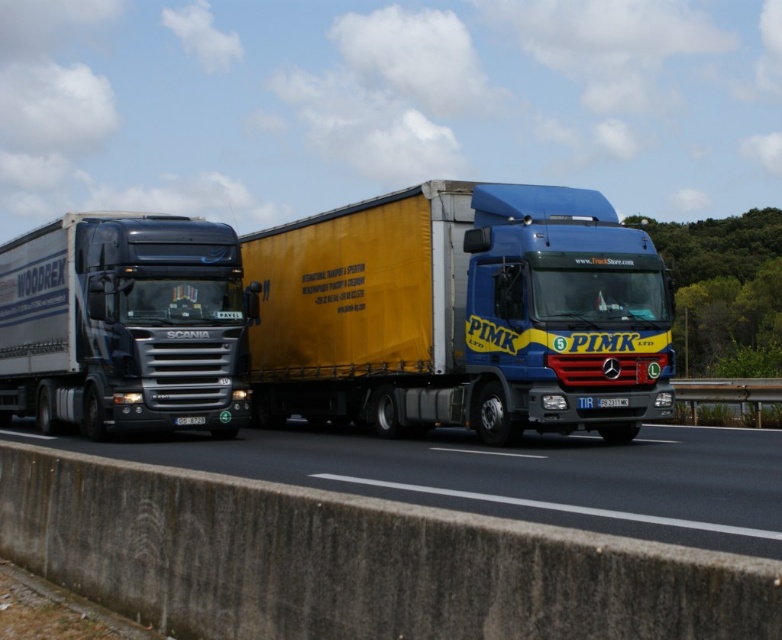
Between metallic silver truck at left and concrete barrier at lower left, which one is positioned lower?

Positioned lower is concrete barrier at lower left.

In the scene shown: Between metallic silver truck at left and concrete barrier at lower left, which one is positioned higher?

metallic silver truck at left

Is point (164, 316) less distant than point (725, 500)?

No, it is behind (725, 500).

Identify the location of metallic silver truck at left. Image resolution: width=782 pixels, height=640 pixels. (124, 324).

Does yellow matte trailer truck at center have a smaller size compared to concrete barrier at lower left?

Actually, yellow matte trailer truck at center might be larger than concrete barrier at lower left.

In the scene shown: Can you confirm if yellow matte trailer truck at center is bigger than concrete barrier at lower left?

Correct, yellow matte trailer truck at center is larger in size than concrete barrier at lower left.

Image resolution: width=782 pixels, height=640 pixels. Describe the element at coordinates (461, 314) in the screenshot. I see `yellow matte trailer truck at center` at that location.

At what (x,y) coordinates should I click in order to perform the action: click on yellow matte trailer truck at center. Please return your answer as a coordinate pair (x, y). Looking at the image, I should click on (461, 314).

Does yellow matte trailer truck at center have a greater height compared to metallic silver truck at left?

No.

Is point (637, 228) positioned behind point (117, 273)?

No.

At what (x,y) coordinates should I click in order to perform the action: click on yellow matte trailer truck at center. Please return your answer as a coordinate pair (x, y). The width and height of the screenshot is (782, 640). Looking at the image, I should click on (461, 314).